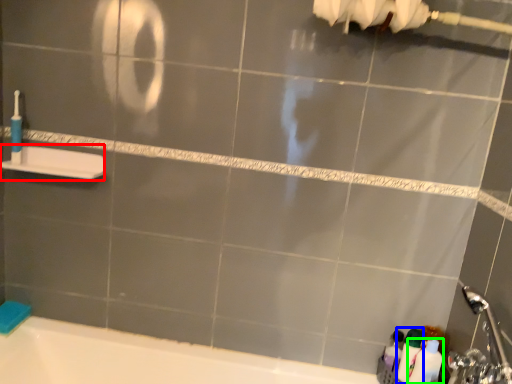
Question: Estimate the real-world distances between objects in this image. Which object is closer to towel bar (highlighted by a red box), cleaning product (highlighted by a blue box) or toiletry (highlighted by a green box)?

Choices:
 (A) cleaning product
 (B) toiletry

Answer: (A)